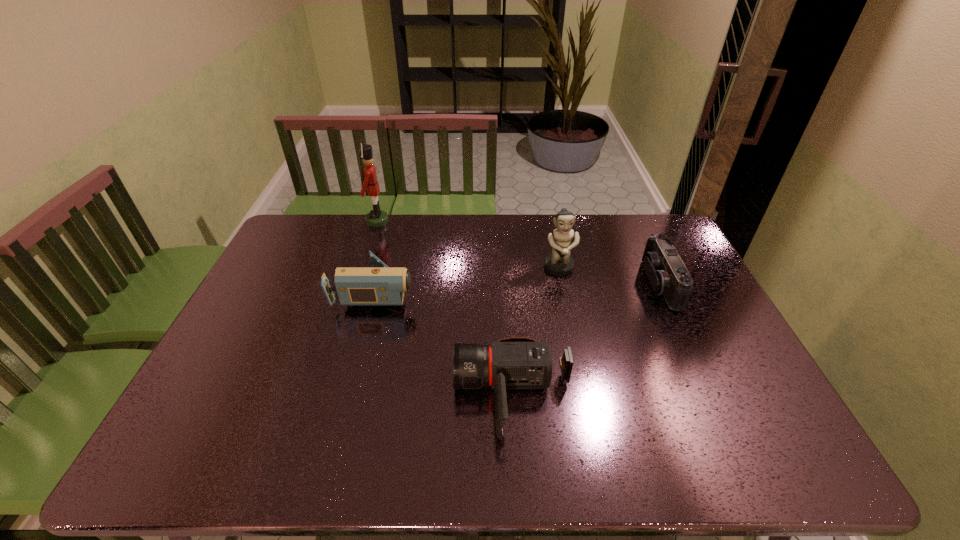
You are a GUI agent. You are given a task and a screenshot of the screen. Output one action in this format:
    pyautogui.click(x=<x>, y=<y>)
    Task: Click on the vacant area that lies between the leftmost camcorder and the second camcorder from left to right
    
    Given the screenshot: What is the action you would take?
    pyautogui.click(x=444, y=343)

Identify the location of free area in between the farthest object and the second camcorder from left to right. The height and width of the screenshot is (540, 960). (445, 308).

Where is `vacant space that is in between the fourth shortest object and the rightmost camcorder`? The height and width of the screenshot is (540, 960). vacant space that is in between the fourth shortest object and the rightmost camcorder is located at coordinates (610, 276).

Find the location of `vacant space that is in between the nutcracker and the leftmost camcorder`. vacant space that is in between the nutcracker and the leftmost camcorder is located at coordinates (377, 256).

The height and width of the screenshot is (540, 960). Find the location of `blank region between the nearest object and the leftmost camcorder`. blank region between the nearest object and the leftmost camcorder is located at coordinates (444, 343).

Identify which object is located as the third nearest to the tallest object. Please provide its 2D coordinates. Your answer should be formatted as a tuple, i.e. [(x, y)], where the tuple contains the x and y coordinates of a point satisfying the conditions above.

[(516, 362)]

At what (x,y) coordinates should I click in order to perform the action: click on object that is the second closest to the second camcorder from left to right. Please return your answer as a coordinate pair (x, y). Looking at the image, I should click on (559, 263).

Identify the location of camcorder that can be found as the closest to the leftmost camcorder. The image size is (960, 540). (x=516, y=362).

This screenshot has width=960, height=540. Find the location of `the closest camcorder to the leftmost camcorder`. the closest camcorder to the leftmost camcorder is located at coordinates (516, 362).

This screenshot has height=540, width=960. Identify the location of vacant region that satisfies the following two spatial constraints: 1. on the front-facing side of the figurine; 2. on the side of the leftmost camcorder with the flip-out screen. (564, 291).